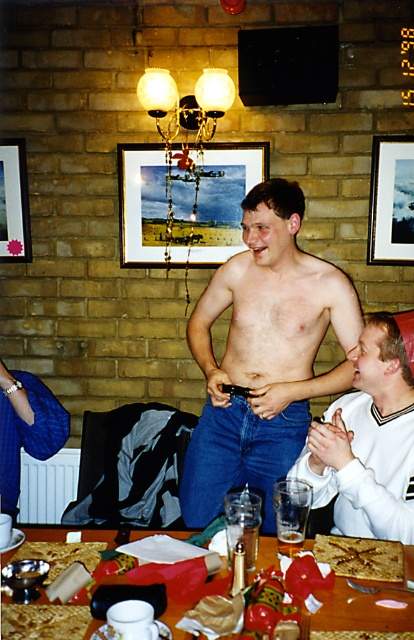
You are a photographer taking a picture of the scene. You notice the smooth white shirt at center and the wooden framed picture at center. Which object should you focus on if you want to capture the taller one?

The smooth white shirt at center is taller than the wooden framed picture at center, so you should focus on the smooth white shirt at center to capture the taller one.

You are a guest at this gathering and want to take a photo of the brown crumbly cake at center and the wooden picture frame at upper left. Which object should you focus on first if you want to capture both in one shot without moving the camera?

The wooden picture frame at upper left is bigger than the brown crumbly cake at center, so you should focus on the wooden picture frame at upper left first to ensure it fits properly in the frame before adjusting for the smaller cake.

You are at a pub and want to hang a new picture on the wall. The wooden framed picture at center is currently hanging between the wooden picture frame at upper left and another object. Which of the two is taller?

The wooden framed picture at center is not as tall as the wooden picture frame at upper left, so the wooden picture frame at upper left is taller.